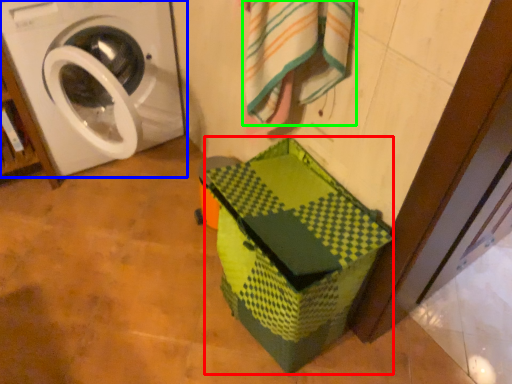
Question: Which object is positioned farthest from cardboard box (highlighted by a red box)? Select from washing machine (highlighted by a blue box) and bath towel (highlighted by a green box).

Choices:
 (A) washing machine
 (B) bath towel

Answer: (A)